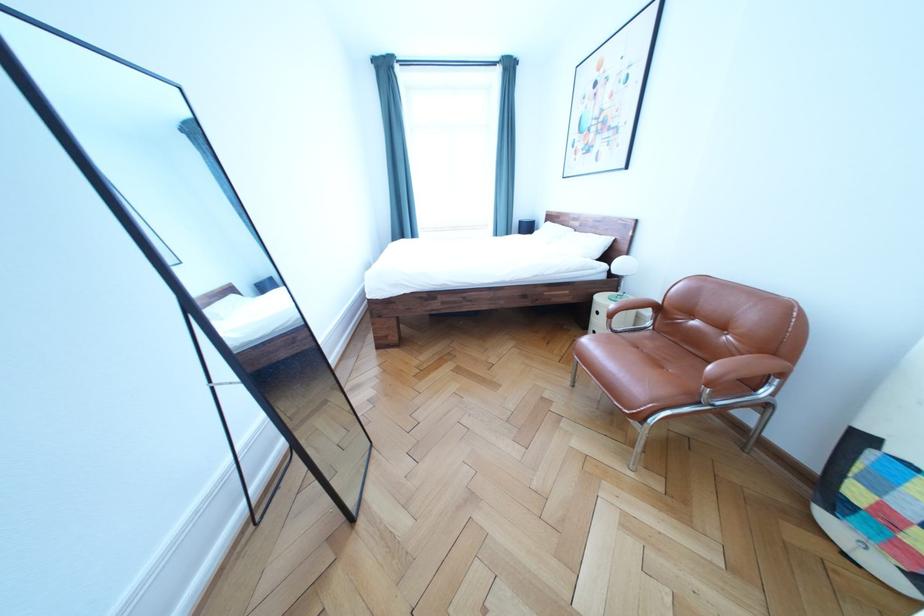
The height and width of the screenshot is (616, 924). Identify the location of white pillow. (506, 285).